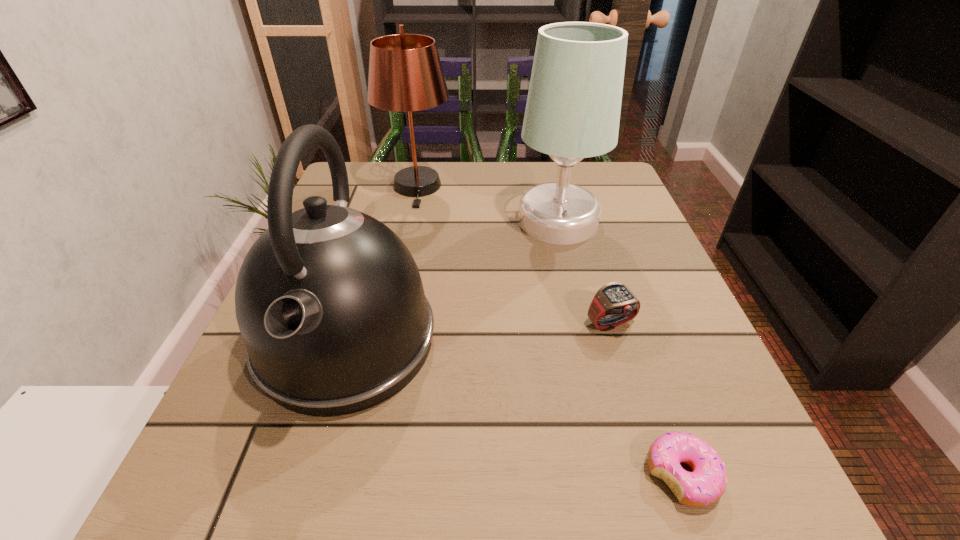
Locate an element on the screen. the right lampshade is located at coordinates (573, 107).

Identify the location of the left lampshade. [405, 74].

This screenshot has width=960, height=540. Find the location of `kettle`. kettle is located at coordinates (329, 301).

Where is `watch`? The height and width of the screenshot is (540, 960). watch is located at coordinates (614, 304).

Find the location of `the nearest object`. the nearest object is located at coordinates (706, 483).

The height and width of the screenshot is (540, 960). In order to click on the shortest object in this screenshot , I will do `click(706, 483)`.

This screenshot has height=540, width=960. Find the location of `vacant space located on the base of the right lampshade`. vacant space located on the base of the right lampshade is located at coordinates (416, 221).

This screenshot has height=540, width=960. What are the coordinates of `free space located on the base of the right lampshade` in the screenshot? It's located at (354, 221).

What are the coordinates of `free spot located on the base of the right lampshade` in the screenshot? It's located at (433, 221).

Locate an element on the screen. free region located 0.110m on the front-facing side of the left lampshade is located at coordinates (406, 235).